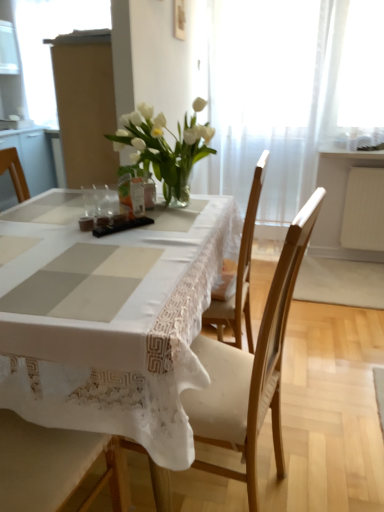
Question: Considering the relative positions of white glass vase at center and matte cardboard box at upper left in the image provided, is white glass vase at center behind matte cardboard box at upper left?

Choices:
 (A) no
 (B) yes

Answer: (A)

Question: Is white glass vase at center wider than matte cardboard box at upper left?

Choices:
 (A) yes
 (B) no

Answer: (A)

Question: Is white glass vase at center outside matte cardboard box at upper left?

Choices:
 (A) no
 (B) yes

Answer: (B)

Question: Is white glass vase at center to the left of matte cardboard box at upper left from the viewer's perspective?

Choices:
 (A) yes
 (B) no

Answer: (B)

Question: From the image's perspective, is white glass vase at center located beneath matte cardboard box at upper left?

Choices:
 (A) no
 (B) yes

Answer: (B)

Question: Is white lace tablecloth at center taller or shorter than clear glass vase at center?

Choices:
 (A) tall
 (B) short

Answer: (A)

Question: From a real-world perspective, is white lace tablecloth at center positioned above or below clear glass vase at center?

Choices:
 (A) below
 (B) above

Answer: (A)

Question: Do you think white lace tablecloth at center is within clear glass vase at center, or outside of it?

Choices:
 (A) outside
 (B) inside

Answer: (A)

Question: Considering the positions of white lace tablecloth at center and clear glass vase at center in the image, is white lace tablecloth at center wider or thinner than clear glass vase at center?

Choices:
 (A) wide
 (B) thin

Answer: (A)

Question: Is matte cardboard box at upper left in front of or behind white glass vase at center in the image?

Choices:
 (A) front
 (B) behind

Answer: (B)

Question: From a real-world perspective, is matte cardboard box at upper left above or below white glass vase at center?

Choices:
 (A) above
 (B) below

Answer: (A)

Question: Does point (31, 14) appear closer or farther from the camera than point (157, 129)?

Choices:
 (A) farther
 (B) closer

Answer: (A)

Question: Is matte cardboard box at upper left wider or thinner than white glass vase at center?

Choices:
 (A) thin
 (B) wide

Answer: (A)

Question: Is clear glass vase at center in front of or behind matte cardboard box at upper left in the image?

Choices:
 (A) behind
 (B) front

Answer: (B)

Question: Considering the positions of point (87, 210) and point (41, 18), is point (87, 210) closer or farther from the camera than point (41, 18)?

Choices:
 (A) farther
 (B) closer

Answer: (B)